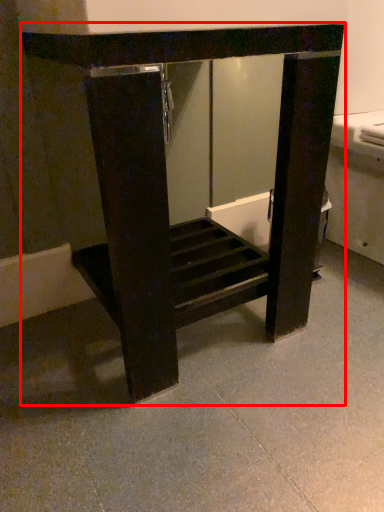
Question: Observing the image, what is the correct spatial positioning of furniture (annotated by the red box) in reference to concrete?

Choices:
 (A) left
 (B) right

Answer: (A)